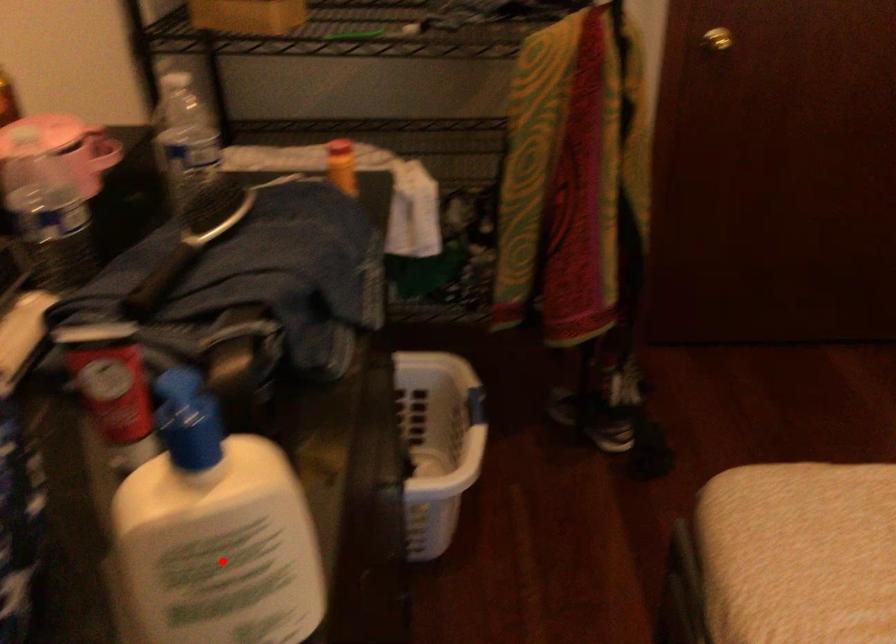
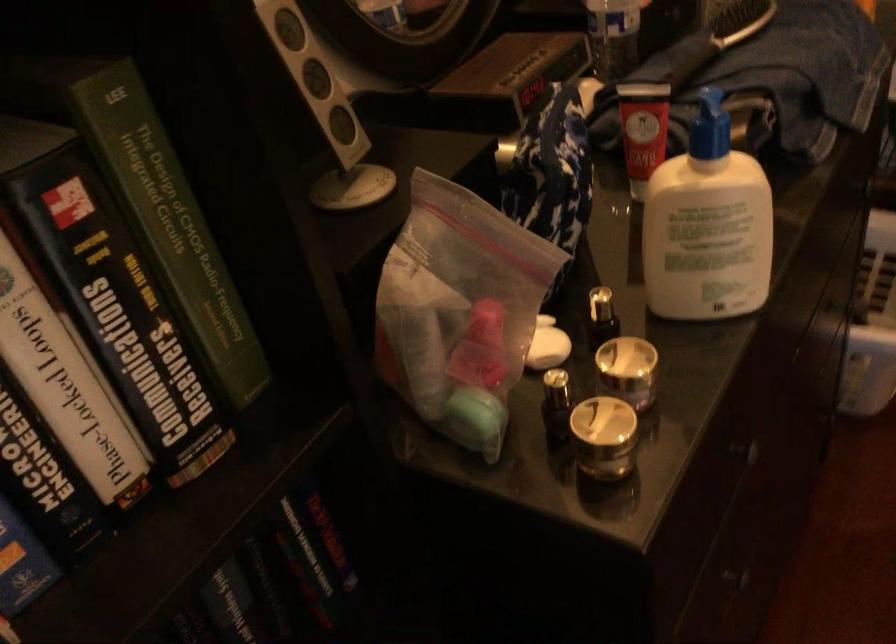
Question: I am providing you with two images of the same scene from different viewpoints. In image1, a red point is highlighted. Considering the same 3D point in image2, which of the following is correct?

Choices:
 (A) It is closer
 (B) It is farther

Answer: (B)